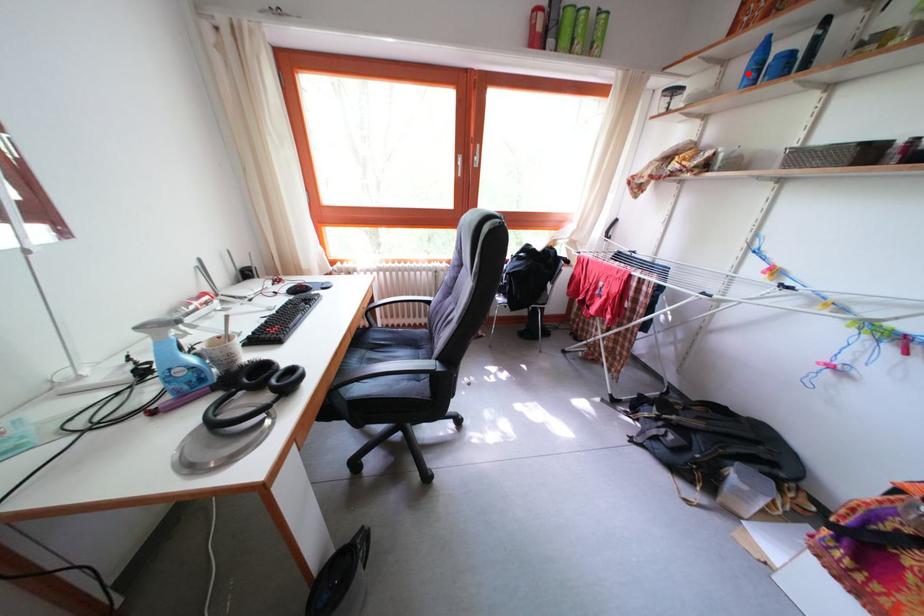
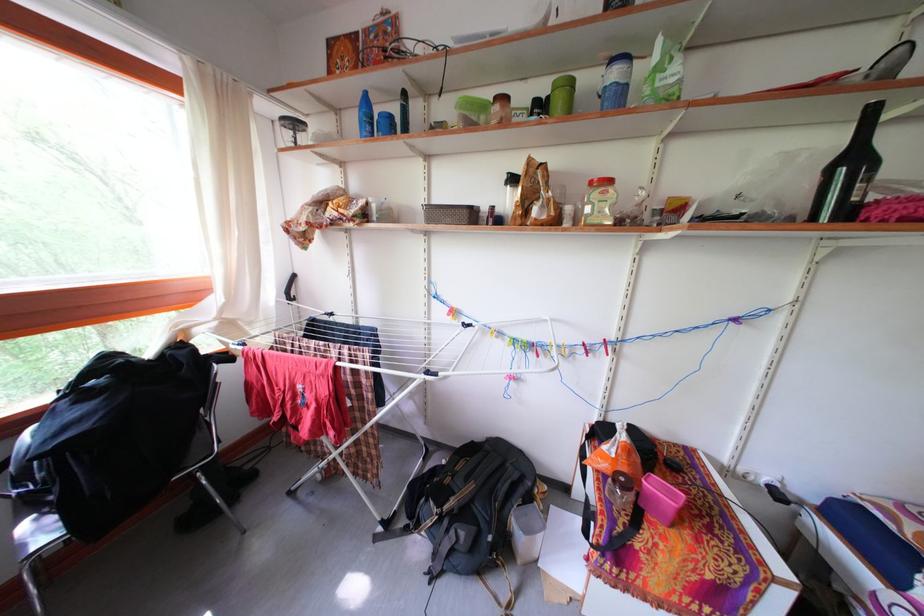
Where in the second image is the point corresponding to the highlighted location from the first image?

(360, 126)